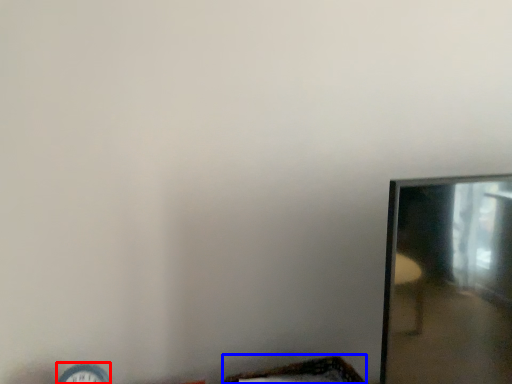
Question: Among these objects, which one is nearest to the camera, clock (highlighted by a red box) or basket (highlighted by a blue box)?

Choices:
 (A) clock
 (B) basket

Answer: (A)